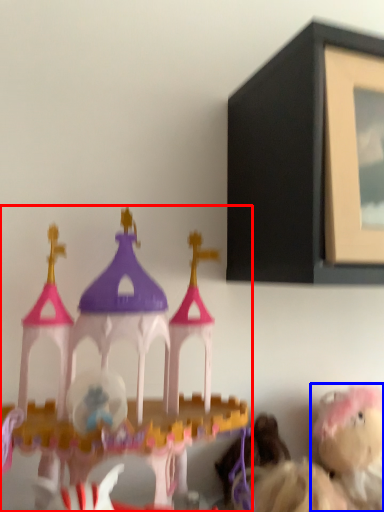
Question: Which object is further to the camera taking this photo, toy (highlighted by a red box) or toy (highlighted by a blue box)?

Choices:
 (A) toy
 (B) toy

Answer: (B)